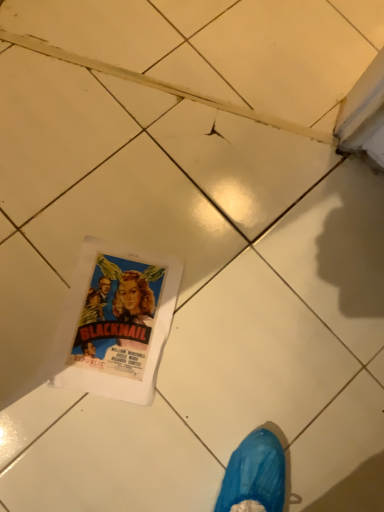
Find the location of a particular element. The image size is (384, 512). free location above matte paper poster at lower left (from a real-world perspective) is located at coordinates (119, 327).